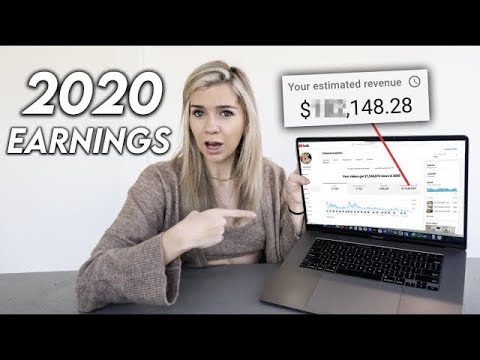
You are a GUI agent. You are given a task and a screenshot of the screen. Output one action in this format:
    pyautogui.click(x=<x>, y=<y>)
    Task: Click on the desk
    This screenshot has height=360, width=480.
    Given the screenshot: What is the action you would take?
    pyautogui.click(x=207, y=301)